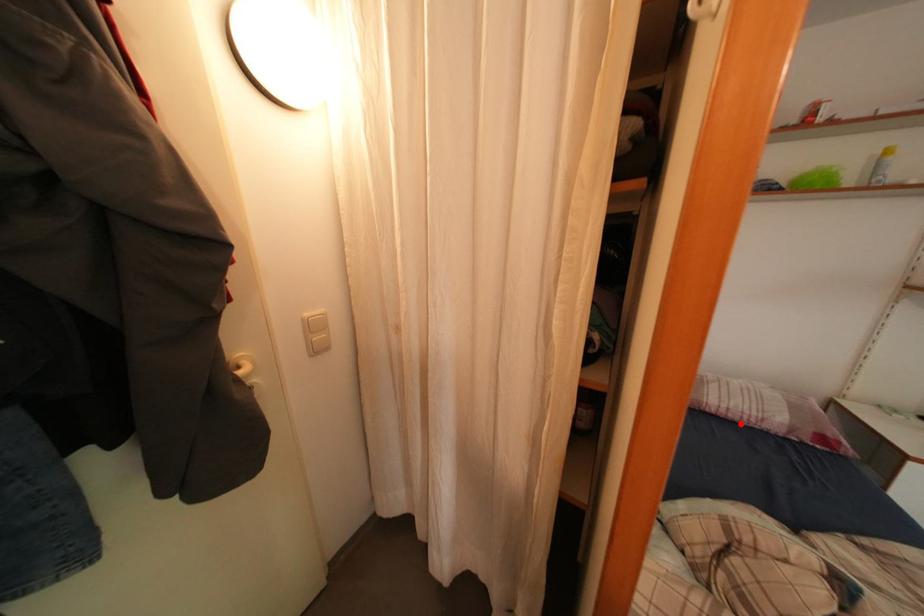
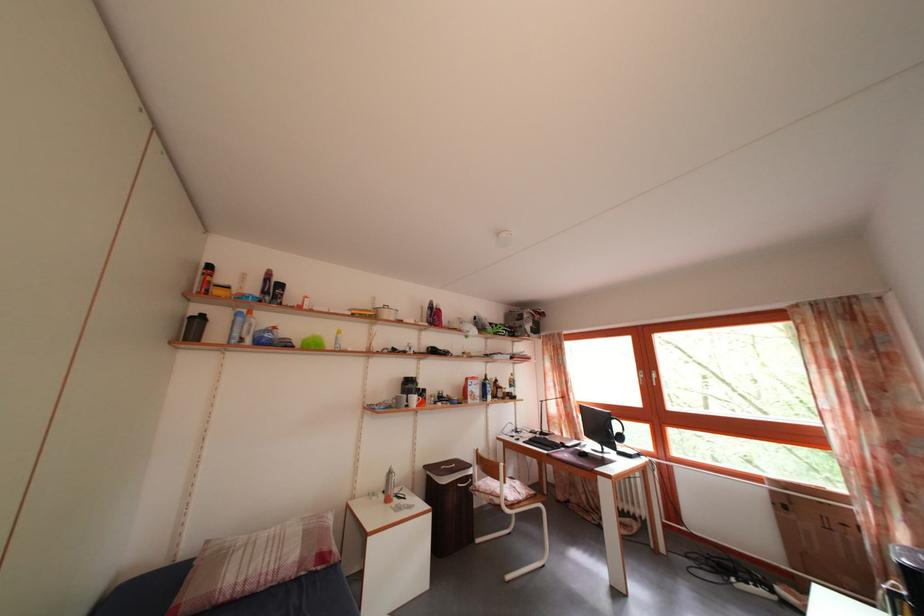
Locate, in the second image, the point that corresponds to the highlighted location in the first image.

(257, 594)